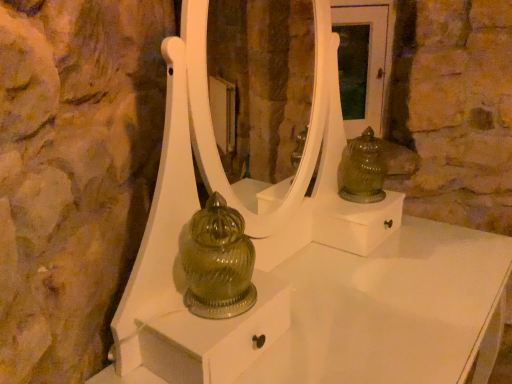
This screenshot has height=384, width=512. Describe the element at coordinates (362, 169) in the screenshot. I see `green glass figurine at upper right` at that location.

I want to click on green glass figurine at upper right, so click(x=362, y=169).

What are the coordinates of `white glossy mirror at center` in the screenshot? It's located at (264, 78).

The image size is (512, 384). Describe the element at coordinates (264, 78) in the screenshot. I see `white glossy mirror at center` at that location.

You are a GUI agent. You are given a task and a screenshot of the screen. Output one action in this format:
    pyautogui.click(x=<x>, y=<y>)
    Task: Click on the green glass figurine at upper right
    
    Given the screenshot: What is the action you would take?
    pyautogui.click(x=362, y=169)

Which object is positioned more to the right, green glass figurine at upper right or white glossy mirror at center?

green glass figurine at upper right is more to the right.

Is green glass figurine at upper right closer to camera compared to white glossy mirror at center?

That is True.

Is point (338, 191) closer to camera compared to point (286, 100)?

That is True.

From the image's perspective, is green glass figurine at upper right positioned above or below white glossy mirror at center?

green glass figurine at upper right is situated lower than white glossy mirror at center in the image.

From a real-world perspective, who is located higher, green glass figurine at upper right or white glossy mirror at center?

In real-world perspective, white glossy mirror at center is above.

Can you confirm if green glass figurine at upper right is thinner than white glossy mirror at center?

Indeed, green glass figurine at upper right has a lesser width compared to white glossy mirror at center.

Considering the sizes of green glass figurine at upper right and white glossy mirror at center in the image, is green glass figurine at upper right taller or shorter than white glossy mirror at center?

Considering their sizes, green glass figurine at upper right has less height than white glossy mirror at center.

Does green glass figurine at upper right have a larger size compared to white glossy mirror at center?

Actually, green glass figurine at upper right might be smaller than white glossy mirror at center.

Is green glass figurine at upper right inside or outside of white glossy mirror at center?

green glass figurine at upper right is outside white glossy mirror at center.

Is there a large distance between green glass figurine at upper right and white glossy mirror at center?

Yes, green glass figurine at upper right and white glossy mirror at center are quite far apart.

Is green glass figurine at upper right oriented towards white glossy mirror at center?

No, green glass figurine at upper right is not facing towards white glossy mirror at center.

Can you tell me how much green glass figurine at upper right and white glossy mirror at center differ in facing direction?

The angular difference between green glass figurine at upper right and white glossy mirror at center is 50 degrees.

What are the coordinates of `figurine on the right of white glossy mirror at center` in the screenshot? It's located at (362, 169).

Visually, is white glossy mirror at center positioned to the left or to the right of green glass figurine at upper right?

white glossy mirror at center is positioned on green glass figurine at upper right's left side.

Which object is further away from the camera, white glossy mirror at center or green glass figurine at upper right?

white glossy mirror at center is more distant.

Which is closer to the camera, [262,168] or [374,163]?

Point [262,168] is positioned farther from the camera compared to point [374,163].

From the image's perspective, which is below, white glossy mirror at center or green glass figurine at upper right?

green glass figurine at upper right, from the image's perspective.

From a real-world perspective, is white glossy mirror at center under green glass figurine at upper right?

No.

Considering the sizes of white glossy mirror at center and green glass figurine at upper right in the image, is white glossy mirror at center wider or thinner than green glass figurine at upper right?

In the image, white glossy mirror at center appears to be wider than green glass figurine at upper right.

Considering the sizes of white glossy mirror at center and green glass figurine at upper right in the image, is white glossy mirror at center taller or shorter than green glass figurine at upper right?

white glossy mirror at center is taller than green glass figurine at upper right.

Considering the relative sizes of white glossy mirror at center and green glass figurine at upper right in the image provided, is white glossy mirror at center bigger than green glass figurine at upper right?

Indeed, white glossy mirror at center has a larger size compared to green glass figurine at upper right.

Looking at this image, is white glossy mirror at center spatially inside green glass figurine at upper right, or outside of it?

white glossy mirror at center is spatially situated outside green glass figurine at upper right.

Is white glossy mirror at center not near green glass figurine at upper right?

Yes, white glossy mirror at center is far from green glass figurine at upper right.

Is white glossy mirror at center aimed at green glass figurine at upper right?

Yes, white glossy mirror at center faces towards green glass figurine at upper right.

The image size is (512, 384). Identify the location of mirror above the green glass figurine at upper right (from a real-world perspective). (264, 78).

Where is `mirror behind the green glass figurine at upper right`? Image resolution: width=512 pixels, height=384 pixels. mirror behind the green glass figurine at upper right is located at coordinates (264, 78).

What are the coordinates of `figurine on the right of white glossy mirror at center` in the screenshot? It's located at (362, 169).